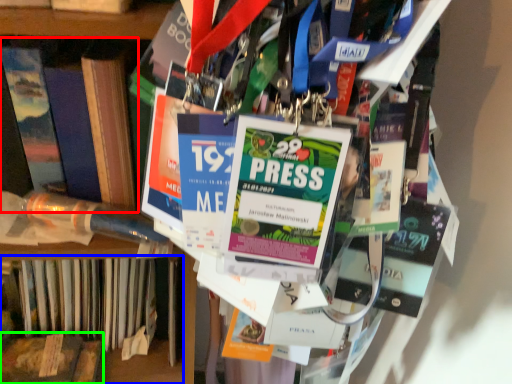
Question: Which object is positioned farthest from book (highlighted by a red box)? Select from book (highlighted by a blue box) and book (highlighted by a green box).

Choices:
 (A) book
 (B) book

Answer: (B)